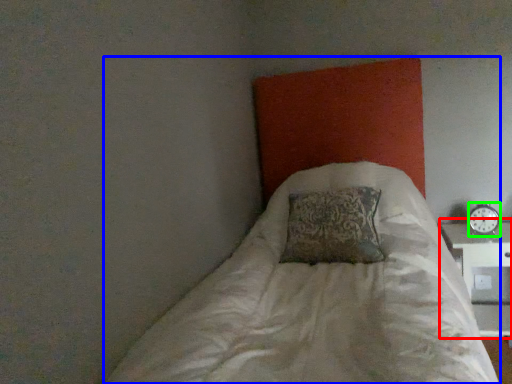
Question: Estimate the real-world distances between objects in this image. Which object is closer to table (highlighted by a red box), bed (highlighted by a blue box) or clock (highlighted by a green box)?

Choices:
 (A) bed
 (B) clock

Answer: (B)